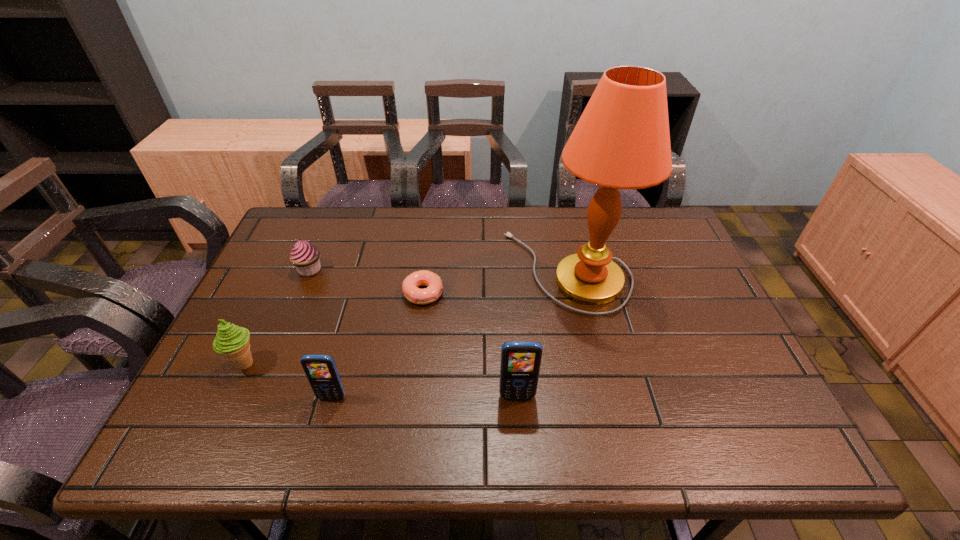
The image size is (960, 540). I want to click on the third object from left to right, so click(x=321, y=371).

Locate an element on the screen. This screenshot has width=960, height=540. the shorter cellular telephone is located at coordinates (321, 371).

The image size is (960, 540). Find the location of `the fifth shortest object`. the fifth shortest object is located at coordinates (520, 364).

I want to click on the taller cellular telephone, so click(520, 364).

Identify the location of lamp. (622, 141).

The image size is (960, 540). I want to click on the second shortest object, so click(x=305, y=256).

Find the location of `the third object from right to left`. the third object from right to left is located at coordinates (410, 285).

Find the location of a particular element. This screenshot has width=960, height=540. the shortest object is located at coordinates (410, 285).

Image resolution: width=960 pixels, height=540 pixels. I want to click on icecream, so click(x=232, y=341).

The image size is (960, 540). I want to click on free space located on the right of the lamp, so click(654, 271).